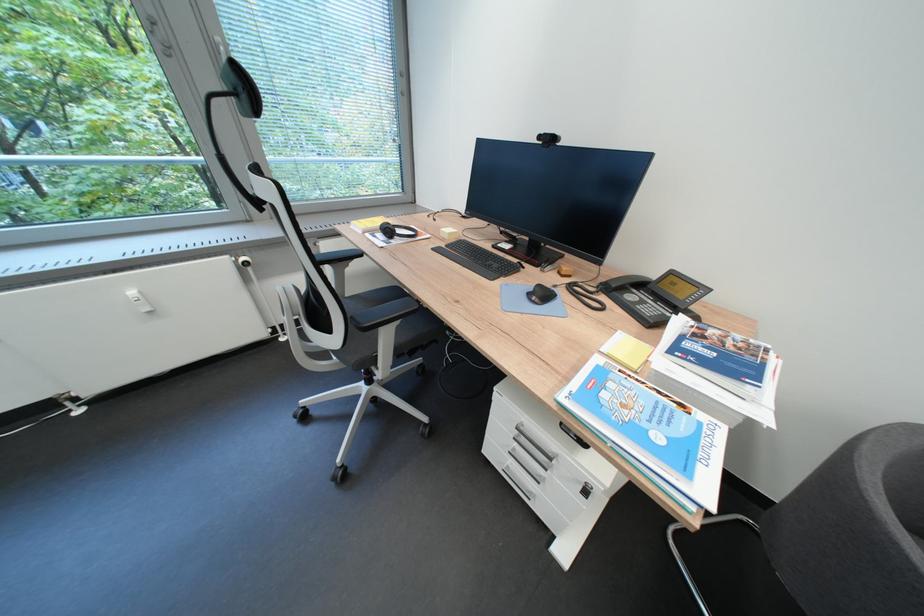
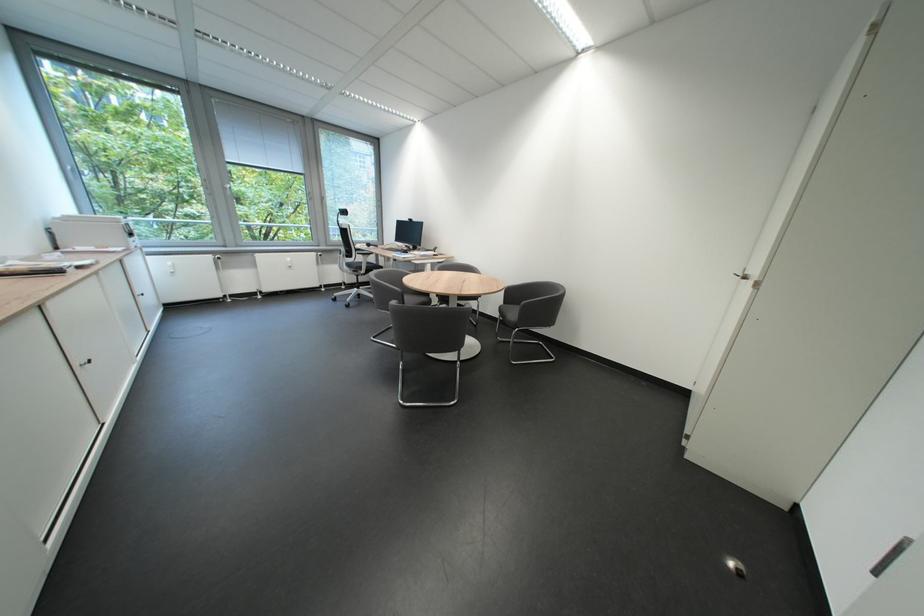
From the picture: The images are taken continuously from a first-person perspective. In which direction are you moving?

The cameraman walked toward right, backward.